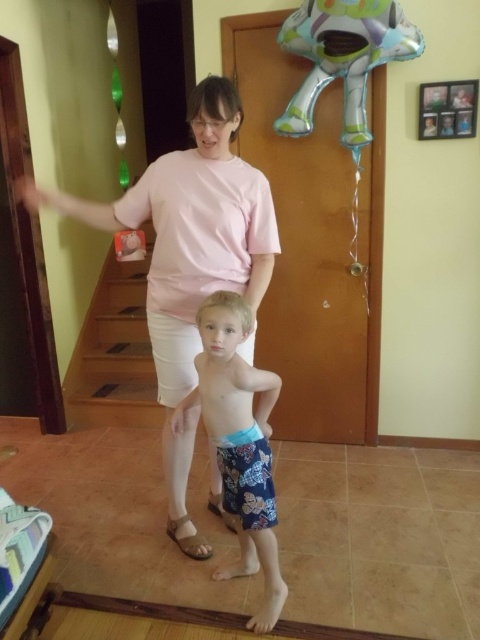
You are a delivery person holding a package and standing in the hallway. You need to place the package on the pink cotton shirt at upper center. However, your arm can only reach 28 inches. Can you reach it from where you are standing next to the brown leather sandal at lower center?

The pink cotton shirt at upper center and brown leather sandal at lower center are 31.18 inches apart from each other. Since your arm can only reach 28 inches, you cannot reach the pink cotton shirt at upper center from the brown leather sandal at lower center.